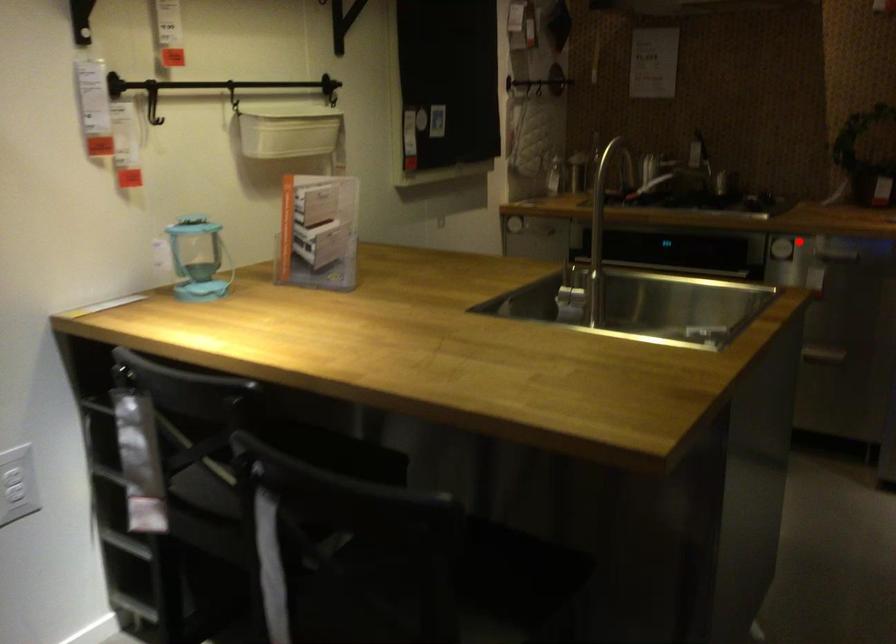
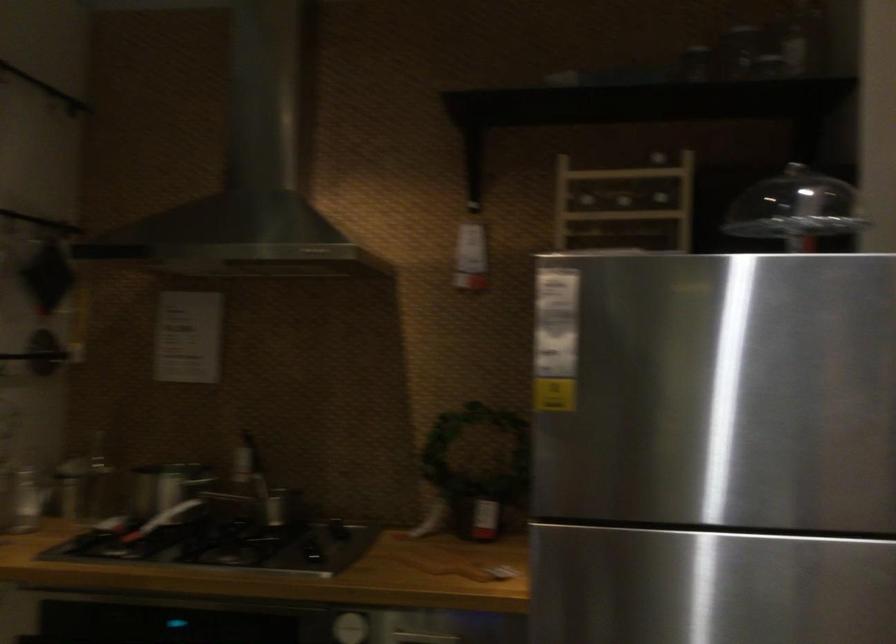
In the second image, find the point that corresponds to the highlighted location in the first image.

(350, 627)